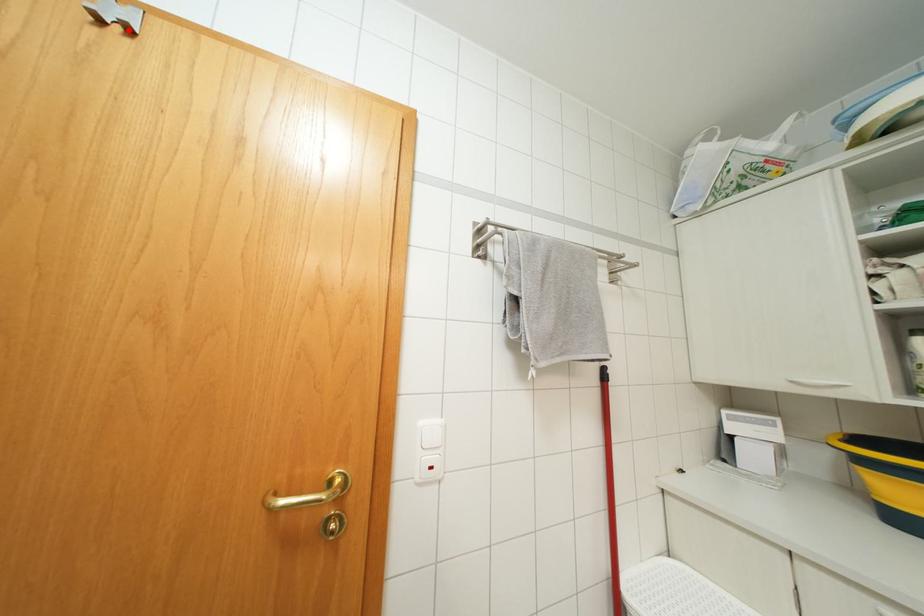
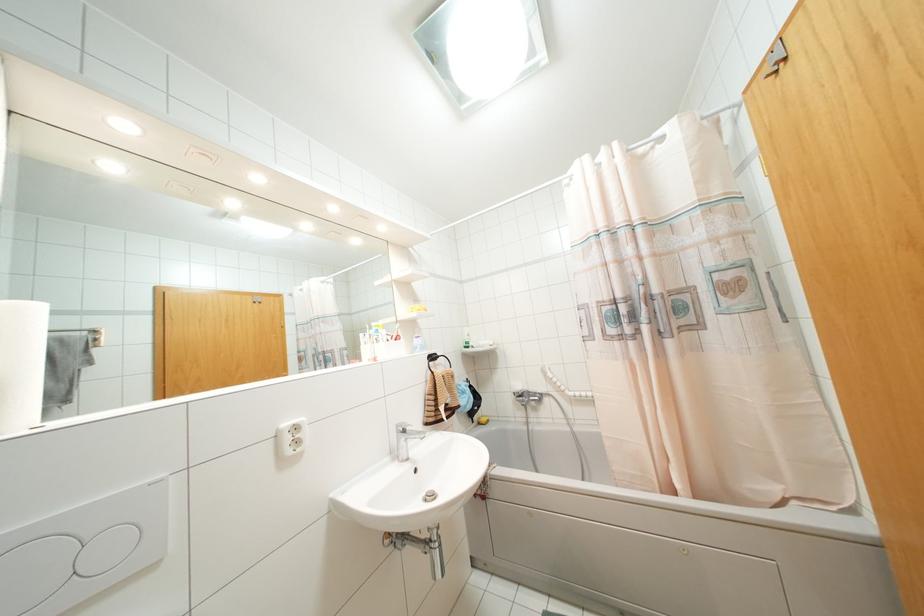
Question: I am providing you with two images of the same scene from different viewpoints. A red point is shown in image1. For the corresponding object point in image2, is it positioned nearer or farther from the camera?

Choices:
 (A) Nearer
 (B) Farther

Answer: (A)